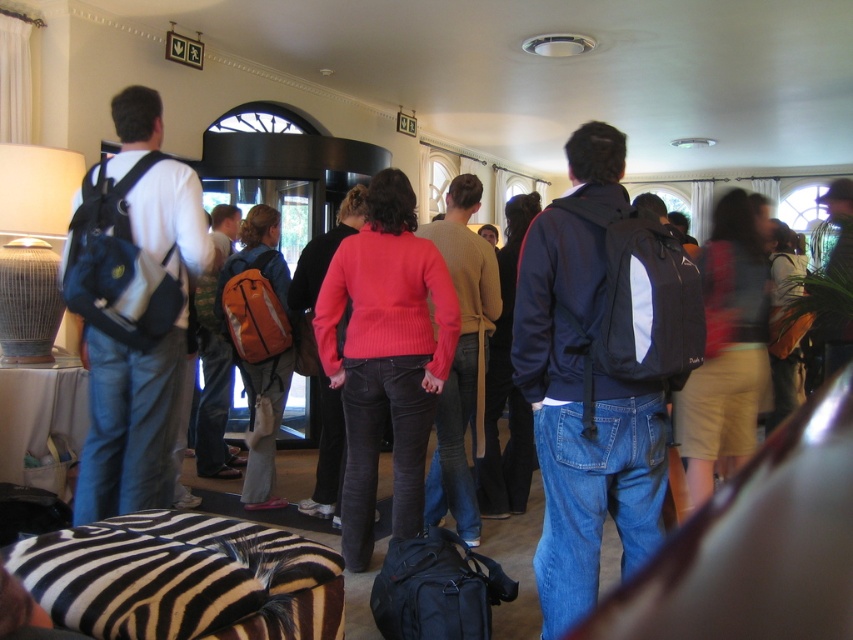
Who is taller, matte blue jacket at center or orange fabric backpack at center?

With more height is orange fabric backpack at center.

Is matte blue jacket at center taller than orange fabric backpack at center?

In fact, matte blue jacket at center may be shorter than orange fabric backpack at center.

Between point (618, 321) and point (265, 284), which one is positioned behind?

The point (265, 284) is behind.

You are a GUI agent. You are given a task and a screenshot of the screen. Output one action in this format:
    pyautogui.click(x=<x>, y=<y>)
    Task: Click on the matte blue jacket at center
    This screenshot has width=853, height=640.
    Given the screenshot: What is the action you would take?
    pyautogui.click(x=599, y=369)

Does matte blue jacket at center appear on the right side of pink knit sweater at center?

Yes, matte blue jacket at center is to the right of pink knit sweater at center.

Between matte blue jacket at center and pink knit sweater at center, which one has more height?

pink knit sweater at center

The height and width of the screenshot is (640, 853). What do you see at coordinates (599, 369) in the screenshot? I see `matte blue jacket at center` at bounding box center [599, 369].

Identify the location of matte blue jacket at center. (599, 369).

Does matte black backpack at left have a greater height compared to pink knit sweater at center?

In fact, matte black backpack at left may be shorter than pink knit sweater at center.

What do you see at coordinates (132, 308) in the screenshot?
I see `matte black backpack at left` at bounding box center [132, 308].

The image size is (853, 640). In order to click on matte black backpack at left in this screenshot , I will do `click(132, 308)`.